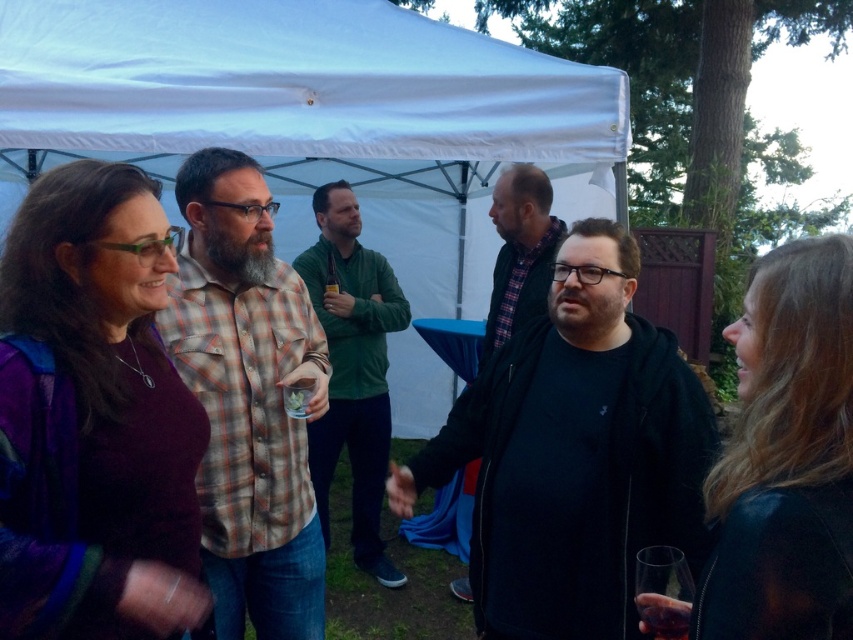
Is white fabric canopy at upper center behind plaid shirt at center?

Yes, white fabric canopy at upper center is further from the viewer.

From the picture: Who is more forward, (99, 93) or (201, 394)?

Point (201, 394) is in front.

Does point (412, 20) come farther from viewer compared to point (314, 342)?

Yes, point (412, 20) is behind point (314, 342).

Where is `white fabric canopy at upper center`? The height and width of the screenshot is (640, 853). white fabric canopy at upper center is located at coordinates (315, 116).

Is point (404, 497) farther from camera compared to point (381, 284)?

No, it is in front of (381, 284).

Between black matte jacket at center and green matte shirt at center, which one appears on the right side from the viewer's perspective?

black matte jacket at center is more to the right.

Which is in front, point (602, 355) or point (379, 513)?

Point (602, 355)

Identify the location of black matte jacket at center. (573, 454).

Who is lower down, plaid shirt at center or dark gray hoodie at center?

plaid shirt at center is lower down.

Does plaid shirt at center have a larger size compared to dark gray hoodie at center?

Yes.

Who is more forward, (274, 296) or (543, 301)?

Point (274, 296) is in front.

Identify the location of plaid shirt at center. The height and width of the screenshot is (640, 853). (248, 400).